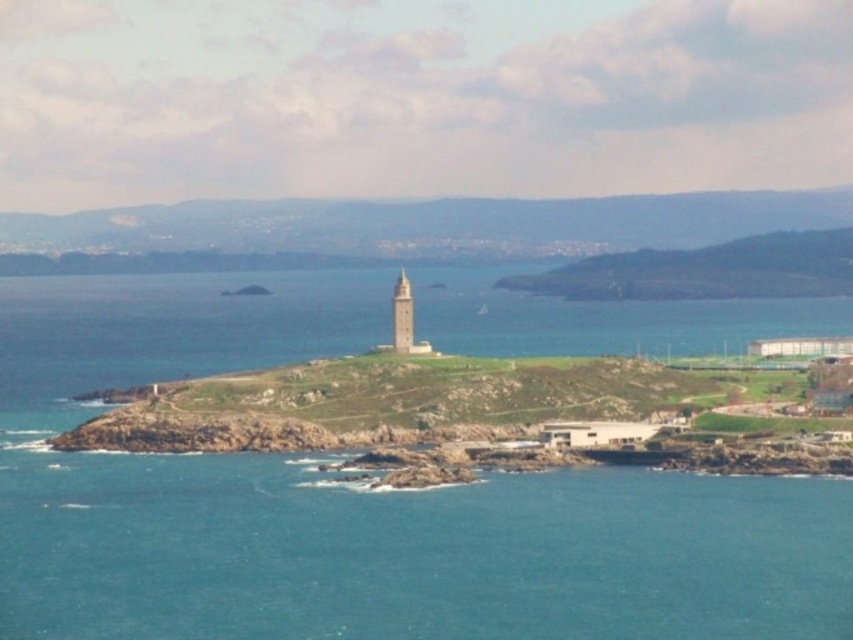
Question: Which object appears farthest from the camera in this image?

Choices:
 (A) white stone tower at center
 (B) blue water at center

Answer: (B)

Question: Can you confirm if blue water at center is thinner than white stone tower at center?

Choices:
 (A) yes
 (B) no

Answer: (B)

Question: Can you confirm if blue water at center is positioned above white stone tower at center?

Choices:
 (A) yes
 (B) no

Answer: (B)

Question: Which of the following is the closest to the observer?

Choices:
 (A) white stone tower at center
 (B) blue water at center

Answer: (A)

Question: Can you confirm if blue water at center is positioned below white stone tower at center?

Choices:
 (A) yes
 (B) no

Answer: (A)

Question: Among these points, which one is nearest to the camera?

Choices:
 (A) (138, 557)
 (B) (410, 291)

Answer: (B)